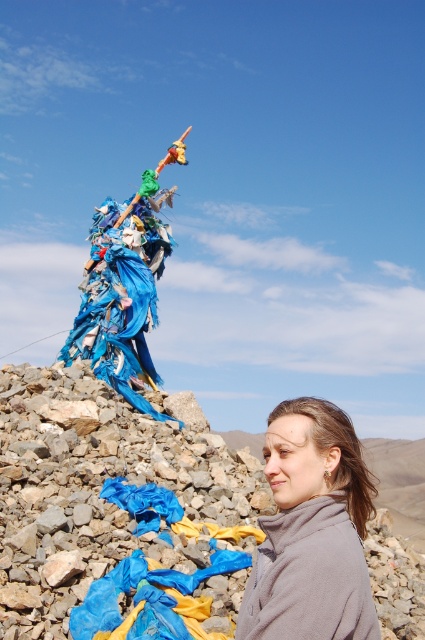
Question: Does blue fabric at lower left appear over gray fleece jacket at center?

Choices:
 (A) no
 (B) yes

Answer: (A)

Question: Is blue fabric at lower left bigger than gray fleece jacket at center?

Choices:
 (A) yes
 (B) no

Answer: (A)

Question: Can you confirm if blue fabric at lower left is smaller than gray fleece jacket at center?

Choices:
 (A) yes
 (B) no

Answer: (B)

Question: Which of the following is the farthest from the observer?

Choices:
 (A) gray fleece jacket at center
 (B) blue fabric at lower left

Answer: (B)

Question: Which of the following is the farthest from the observer?

Choices:
 (A) gray fleece jacket at center
 (B) blue fabric at lower left

Answer: (B)